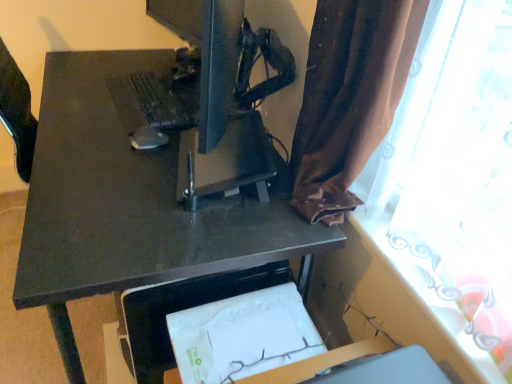
At what (x,y) coordinates should I click in order to perform the action: click on free space above brown fabric curtain at upper right (from a real-world perspective). Please return your answer as a coordinate pair (x, y). Looking at the image, I should click on pyautogui.click(x=404, y=267).